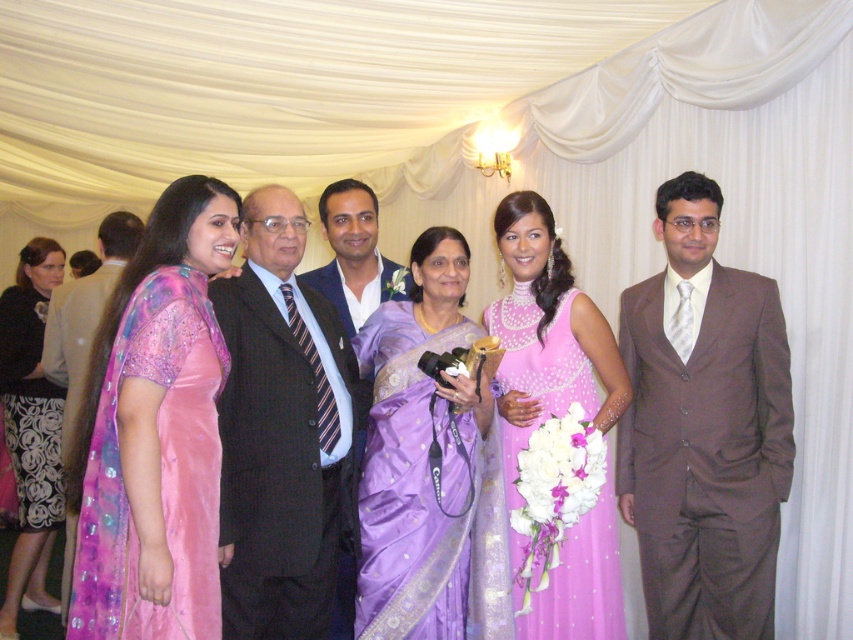
Question: Is dark blue suit at center thinner than pink satin saree at center?

Choices:
 (A) yes
 (B) no

Answer: (A)

Question: Which object is closer to the camera taking this photo?

Choices:
 (A) pink satin saree at left
 (B) purple satin saree at center

Answer: (A)

Question: Based on their relative distances, which object is farther from the brown satin suit at right?

Choices:
 (A) pink satin saree at center
 (B) pink satin saree at left
 (C) dark blue textured suit at center
 (D) shiny black suit at left

Answer: (D)

Question: Which of the following is the farthest from the observer?

Choices:
 (A) (352, 336)
 (B) (354, 189)
 (C) (260, 356)

Answer: (B)

Question: Does purple satin saree at center have a larger size compared to pink satin dress at center?

Choices:
 (A) yes
 (B) no

Answer: (B)

Question: Where is purple satin saree at center located in relation to dark blue suit at center in the image?

Choices:
 (A) left
 (B) right

Answer: (B)